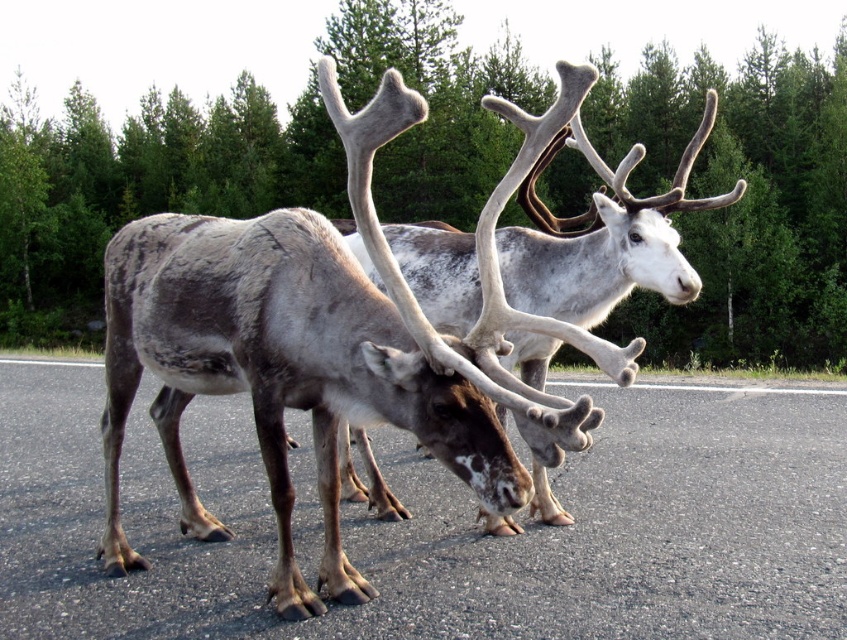
Question: Does grayish-brown fur reindeer at center appear over gray speckled fur at center?

Choices:
 (A) no
 (B) yes

Answer: (A)

Question: Which of the following is the farthest from the observer?

Choices:
 (A) grayish-brown fur reindeer at center
 (B) gray speckled fur at center

Answer: (B)

Question: Considering the relative positions of grayish-brown fur reindeer at center and gray speckled fur at center in the image provided, where is grayish-brown fur reindeer at center located with respect to gray speckled fur at center?

Choices:
 (A) above
 (B) below

Answer: (B)

Question: Among these objects, which one is nearest to the camera?

Choices:
 (A) gray speckled fur at center
 (B) grayish-brown fur reindeer at center

Answer: (B)

Question: Is grayish-brown fur reindeer at center bigger than gray speckled fur at center?

Choices:
 (A) yes
 (B) no

Answer: (A)